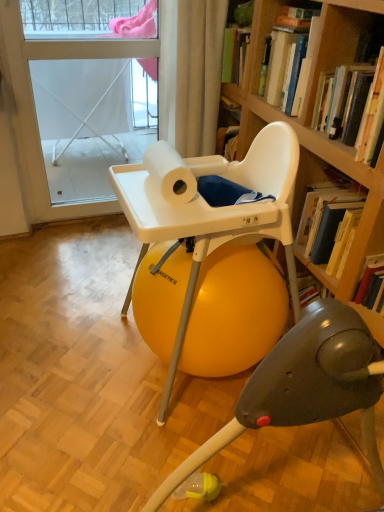
You are a GUI agent. You are given a task and a screenshot of the screen. Output one action in this format:
    pyautogui.click(x=<x>, y=<y>)
    Task: Click on the blank space to the left of white plastic highchair at center
    The width and height of the screenshot is (384, 512).
    Given the screenshot: What is the action you would take?
    pyautogui.click(x=74, y=351)